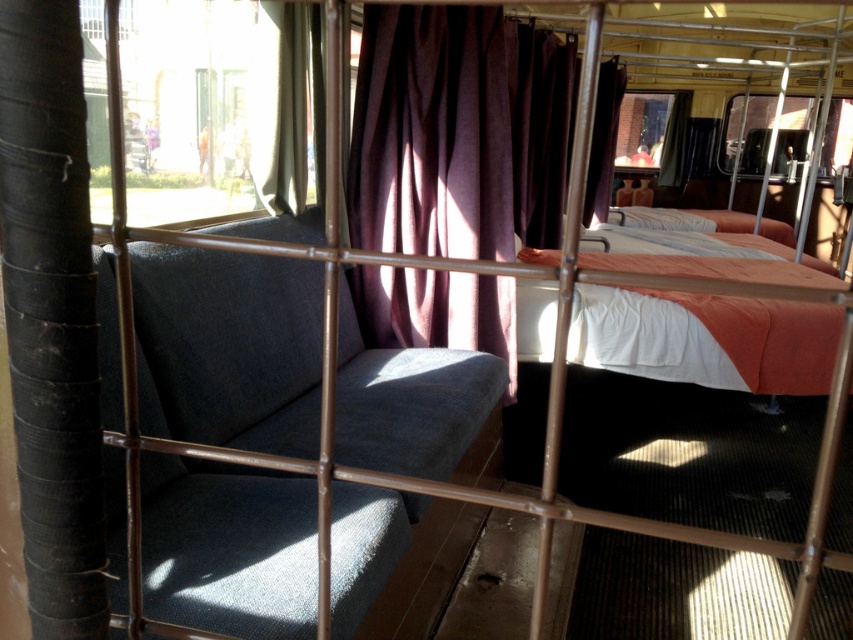
Question: Which object is positioned closest to the purple fabric curtain at center?

Choices:
 (A) textured gray couch at left
 (B) white cotton bed at center

Answer: (A)

Question: Which point appears farthest from the camera in this image?

Choices:
 (A) (486, 388)
 (B) (775, 326)
 (C) (305, 177)
 (D) (457, 234)

Answer: (B)

Question: Which object is the closest to the purple fabric curtain at center?

Choices:
 (A) white cotton bed at center
 (B) textured gray couch at left

Answer: (B)

Question: Is textured gray couch at left bigger than matte purple curtain at upper left?

Choices:
 (A) no
 (B) yes

Answer: (B)

Question: Is textured gray couch at left smaller than white cotton bed at center?

Choices:
 (A) no
 (B) yes

Answer: (B)

Question: Is textured gray couch at left behind purple fabric curtain at center?

Choices:
 (A) no
 (B) yes

Answer: (A)